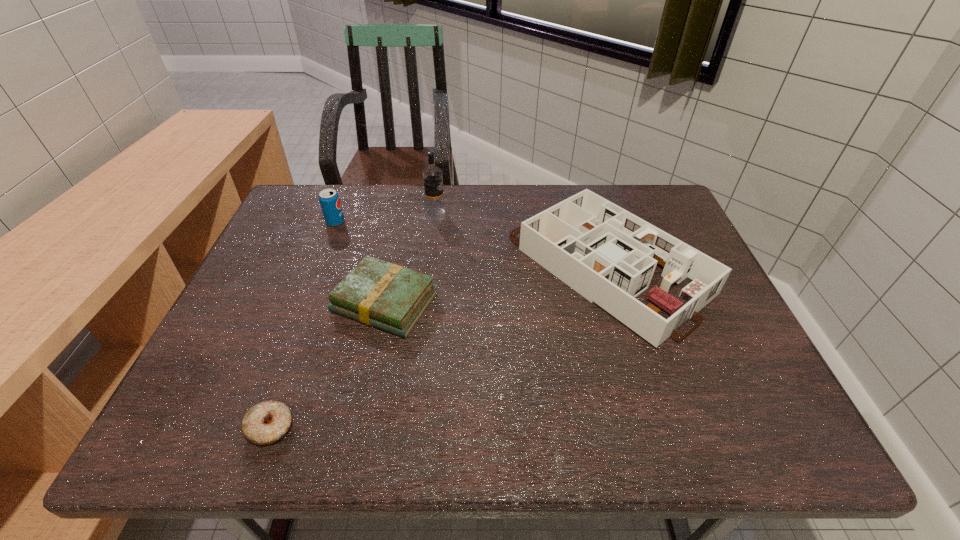
Locate an element on the screen. free point located 0.350m on the right of the doughnut is located at coordinates (478, 427).

You are a GUI agent. You are given a task and a screenshot of the screen. Output one action in this format:
    pyautogui.click(x=<x>, y=<y>)
    Task: Click on the vodka that is positioned at the far edge
    This screenshot has height=540, width=960.
    Given the screenshot: What is the action you would take?
    pyautogui.click(x=432, y=175)

Where is `soda can situated at the far edge`? The width and height of the screenshot is (960, 540). soda can situated at the far edge is located at coordinates (329, 200).

You are a GUI agent. You are given a task and a screenshot of the screen. Output one action in this format:
    pyautogui.click(x=<x>, y=<y>)
    Task: Click on the dollhouse that is at the far edge
    This screenshot has width=960, height=540.
    Given the screenshot: What is the action you would take?
    pyautogui.click(x=608, y=255)

This screenshot has height=540, width=960. What are the coordinates of `object located at the near edge` in the screenshot? It's located at (265, 423).

The height and width of the screenshot is (540, 960). Identify the location of soda can at the left edge. (329, 200).

The image size is (960, 540). I want to click on doughnut that is at the left edge, so click(265, 423).

You are a GUI agent. You are given a task and a screenshot of the screen. Output one action in this format:
    pyautogui.click(x=<x>, y=<y>)
    Task: Click on the object that is at the right edge
    Image resolution: width=960 pixels, height=540 pixels.
    Given the screenshot: What is the action you would take?
    pyautogui.click(x=608, y=255)

Identify the location of object at the far left corner. (329, 200).

The width and height of the screenshot is (960, 540). Find the location of `object that is at the near left corner`. object that is at the near left corner is located at coordinates (265, 423).